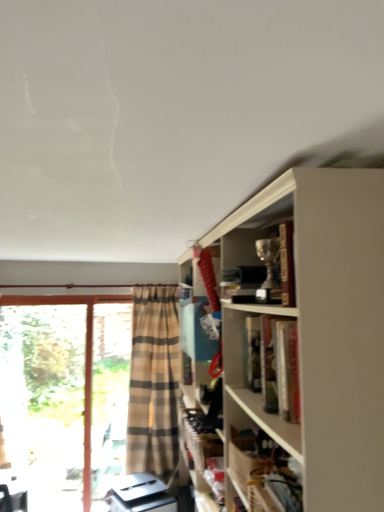
Question: Considering the relative sizes of metallic trophy at upper right and clear glass screen door at left in the image provided, is metallic trophy at upper right thinner than clear glass screen door at left?

Choices:
 (A) no
 (B) yes

Answer: (A)

Question: Would you say clear glass screen door at left is part of metallic trophy at upper right's contents?

Choices:
 (A) no
 (B) yes

Answer: (A)

Question: Is metallic trophy at upper right at the right side of clear glass screen door at left?

Choices:
 (A) yes
 (B) no

Answer: (A)

Question: Is metallic trophy at upper right wider than clear glass screen door at left?

Choices:
 (A) yes
 (B) no

Answer: (A)

Question: Does metallic trophy at upper right have a greater height compared to clear glass screen door at left?

Choices:
 (A) no
 (B) yes

Answer: (A)

Question: Considering their positions, is beige plaid curtain at left located in front of or behind metallic trophy at upper right?

Choices:
 (A) front
 (B) behind

Answer: (B)

Question: From a real-world perspective, relative to metallic trophy at upper right, is beige plaid curtain at left vertically above or below?

Choices:
 (A) below
 (B) above

Answer: (A)

Question: Considering the relative positions of beige plaid curtain at left and metallic trophy at upper right in the image provided, is beige plaid curtain at left to the left or to the right of metallic trophy at upper right?

Choices:
 (A) right
 (B) left

Answer: (B)

Question: Considering the positions of beige plaid curtain at left and metallic trophy at upper right in the image, is beige plaid curtain at left bigger or smaller than metallic trophy at upper right?

Choices:
 (A) big
 (B) small

Answer: (A)

Question: Considering the positions of transparent glass door at left and wooden shelf at lower right in the image, is transparent glass door at left taller or shorter than wooden shelf at lower right?

Choices:
 (A) tall
 (B) short

Answer: (A)

Question: Would you say transparent glass door at left is inside or outside wooden shelf at lower right?

Choices:
 (A) inside
 (B) outside

Answer: (B)

Question: In terms of width, does transparent glass door at left look wider or thinner when compared to wooden shelf at lower right?

Choices:
 (A) thin
 (B) wide

Answer: (A)

Question: Does point (54, 475) appear closer or farther from the camera than point (271, 493)?

Choices:
 (A) closer
 (B) farther

Answer: (B)

Question: Based on their positions, is metallic trophy at upper right located to the left or right of wooden shelf at lower right?

Choices:
 (A) left
 (B) right

Answer: (A)

Question: Is metallic trophy at upper right in front of or behind wooden shelf at lower right in the image?

Choices:
 (A) front
 (B) behind

Answer: (B)